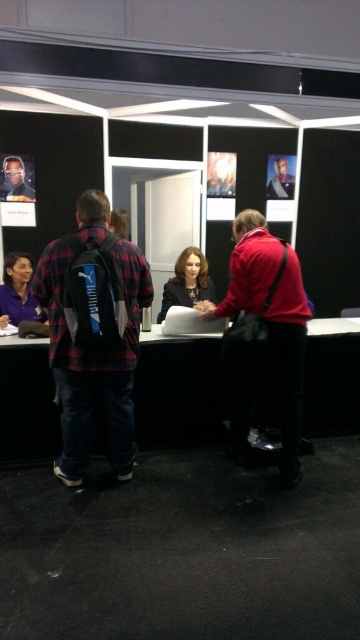
Question: Estimate the real-world distances between objects in this image. Which object is closer to the matte black face at upper left?

Choices:
 (A) matte red jacket at center
 (B) purple fabric shirt at lower left
 (C) matte black shirt at center
 (D) plaid fabric backpack at left

Answer: (B)

Question: Which point is farther to the camera?

Choices:
 (A) (18, 164)
 (B) (29, 259)
 (C) (114, 404)
 (D) (191, 305)

Answer: (A)

Question: Does black glossy table at center have a greater width compared to matte black shirt at center?

Choices:
 (A) no
 (B) yes

Answer: (B)

Question: Does matte red jacket at center come behind matte black shirt at center?

Choices:
 (A) no
 (B) yes

Answer: (A)

Question: Is matte black shirt at center further to the viewer compared to purple fabric shirt at lower left?

Choices:
 (A) no
 (B) yes

Answer: (B)

Question: Which object is the closest to the plaid fabric backpack at left?

Choices:
 (A) matte red jacket at center
 (B) black glossy table at center
 (C) purple fabric shirt at lower left
 (D) matte black face at upper left

Answer: (B)